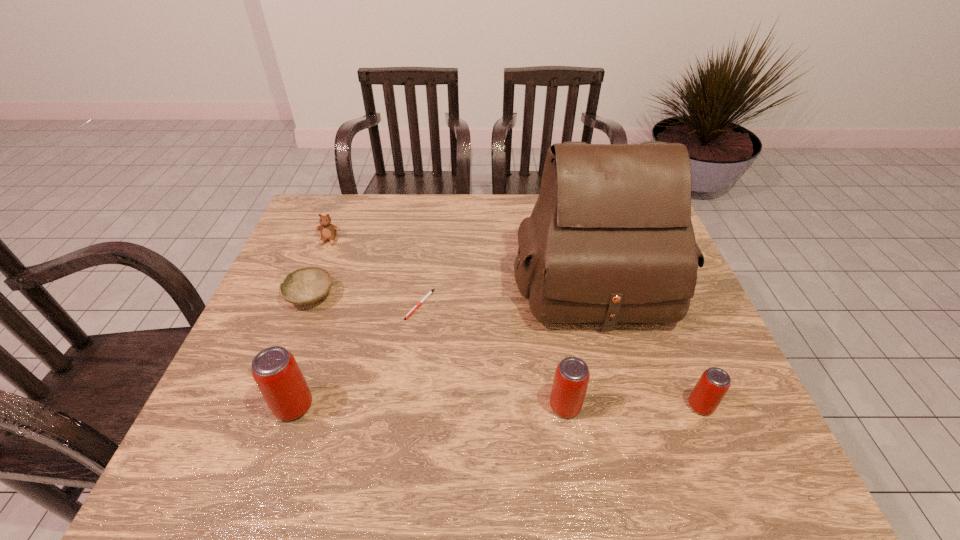
Where is `teddy bear located at the left edge`? This screenshot has height=540, width=960. teddy bear located at the left edge is located at coordinates (328, 231).

The width and height of the screenshot is (960, 540). I want to click on bowl that is at the left edge, so click(307, 285).

The image size is (960, 540). I want to click on beer can present at the right edge, so click(x=709, y=391).

Where is `satchel positioned at the right edge`? satchel positioned at the right edge is located at coordinates (610, 240).

The width and height of the screenshot is (960, 540). I want to click on object present at the far left corner, so click(x=328, y=231).

Where is `object that is positioned at the near left corner`? object that is positioned at the near left corner is located at coordinates (275, 370).

The image size is (960, 540). Find the location of `object that is at the near right corner`. object that is at the near right corner is located at coordinates (709, 391).

Where is `free spot at the far edge of the desktop`? This screenshot has width=960, height=540. free spot at the far edge of the desktop is located at coordinates (363, 213).

Where is `vacant space at the near edge`? This screenshot has width=960, height=540. vacant space at the near edge is located at coordinates (421, 427).

Identify the location of vacant position at the far left corner of the desktop. The image size is (960, 540). (320, 196).